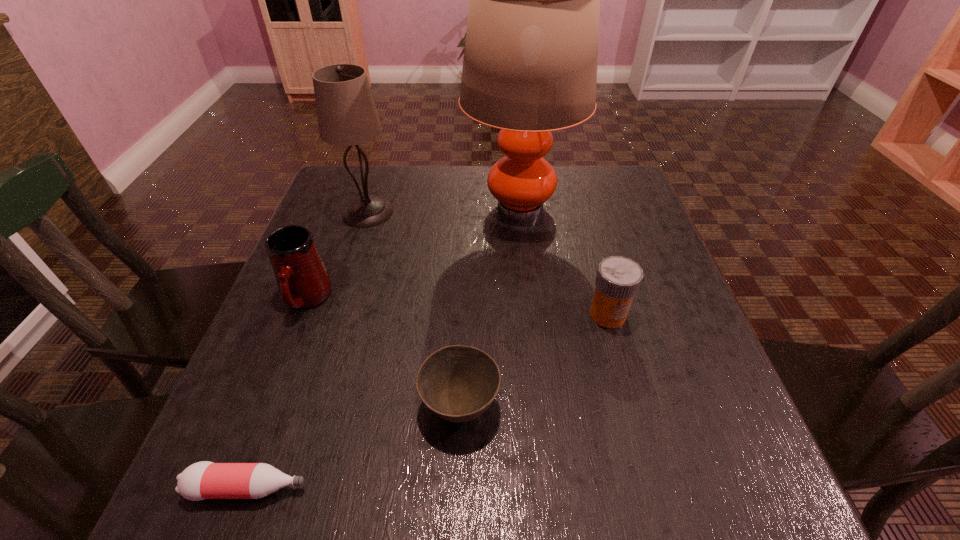
Where is `object that is the second closest one to the second shortest object`? Image resolution: width=960 pixels, height=540 pixels. object that is the second closest one to the second shortest object is located at coordinates (618, 279).

Select which object is the fifth closest to the second shortest object. Please provide its 2D coordinates. Your answer should be formatted as a tuple, i.e. [(x, y)], where the tuple contains the x and y coordinates of a point satisfying the conditions above.

[(346, 112)]

The image size is (960, 540). In order to click on vacant position in the image that satisfies the following two spatial constraints: 1. on the front side of the tallest object; 2. on the front-facing side of the lampshade in this screenshot , I will do [519, 212].

Identify the location of vacant region that satisfies the following two spatial constraints: 1. on the front-facing side of the lampshade; 2. on the back side of the fifth tallest object. (308, 406).